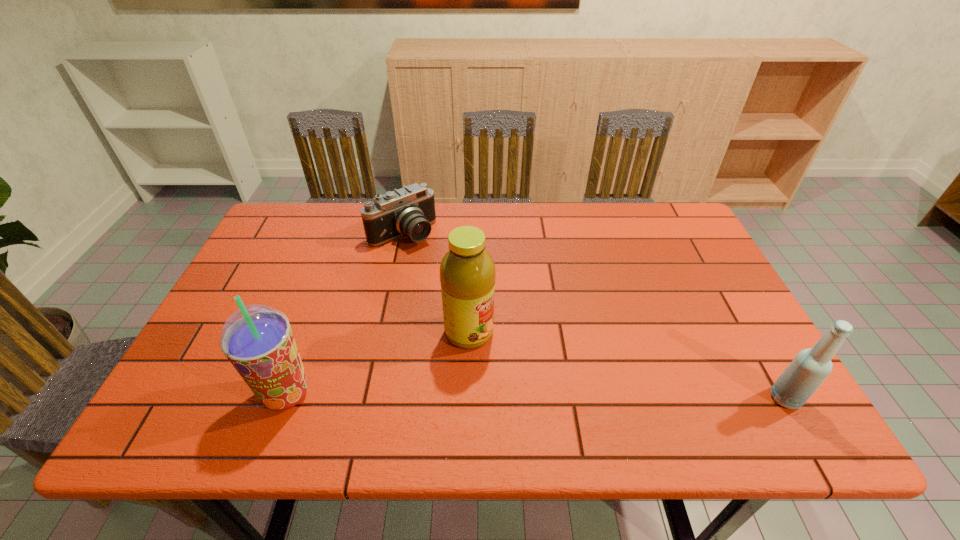
The width and height of the screenshot is (960, 540). Identify the location of free location that satisfies the following two spatial constraints: 1. on the front side of the bottle; 2. on the right side of the leftmost object. (285, 398).

This screenshot has height=540, width=960. I want to click on free space that satisfies the following two spatial constraints: 1. on the back side of the leftmost object; 2. on the right side of the third object from left to right, so click(309, 333).

Where is `vacant region that satisfies the following two spatial constraints: 1. on the back side of the camera; 2. on the right side of the smoothie`? This screenshot has height=540, width=960. vacant region that satisfies the following two spatial constraints: 1. on the back side of the camera; 2. on the right side of the smoothie is located at coordinates (345, 233).

Locate an element on the screen. The width and height of the screenshot is (960, 540). free point that satisfies the following two spatial constraints: 1. on the front side of the second object from left to right; 2. on the left side of the fruit juice is located at coordinates (382, 333).